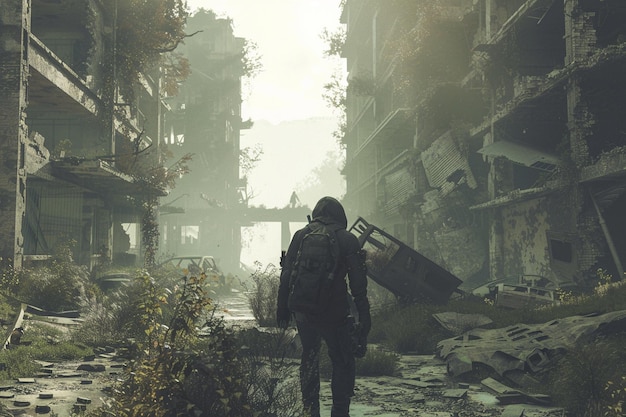
Image resolution: width=626 pixels, height=417 pixels. I want to click on ledge, so click(96, 173).